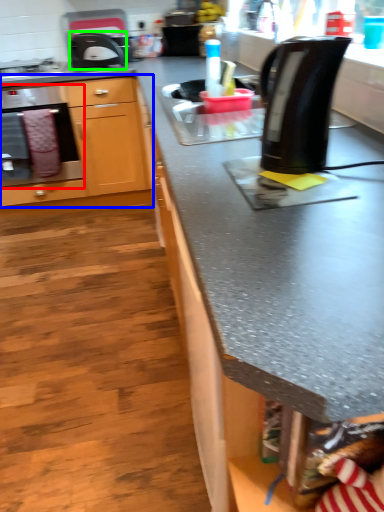
Question: Based on their relative distances, which object is nearer to oven (highlighted by a red box)? Choose from cabinetry (highlighted by a blue box) and kitchen appliance (highlighted by a green box).

Choices:
 (A) cabinetry
 (B) kitchen appliance

Answer: (A)